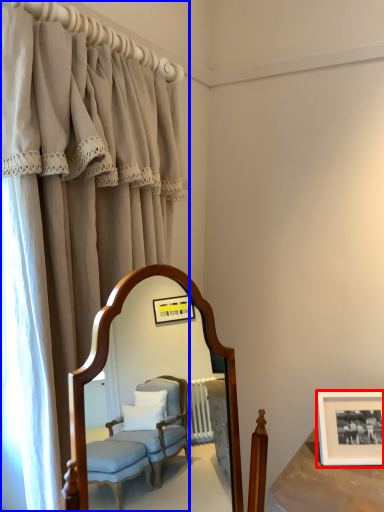
Question: Which object appears farthest to the camera in this image, picture frame (highlighted by a red box) or curtain (highlighted by a blue box)?

Choices:
 (A) picture frame
 (B) curtain

Answer: (A)